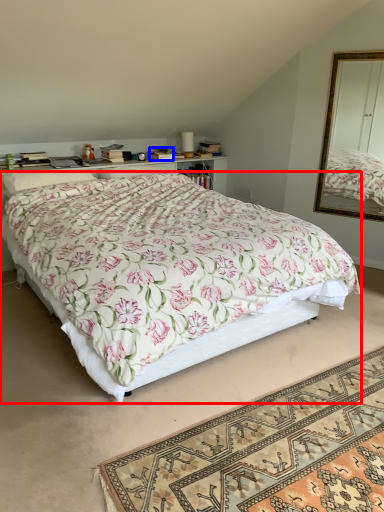
Question: Which object appears closest to the camera in this image, bed (highlighted by a red box) or box (highlighted by a blue box)?

Choices:
 (A) bed
 (B) box

Answer: (A)